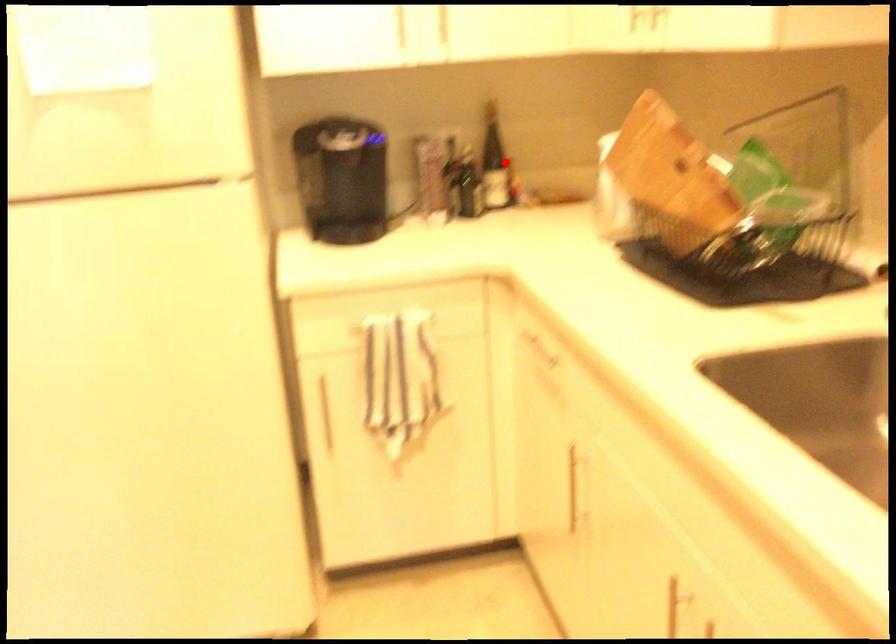
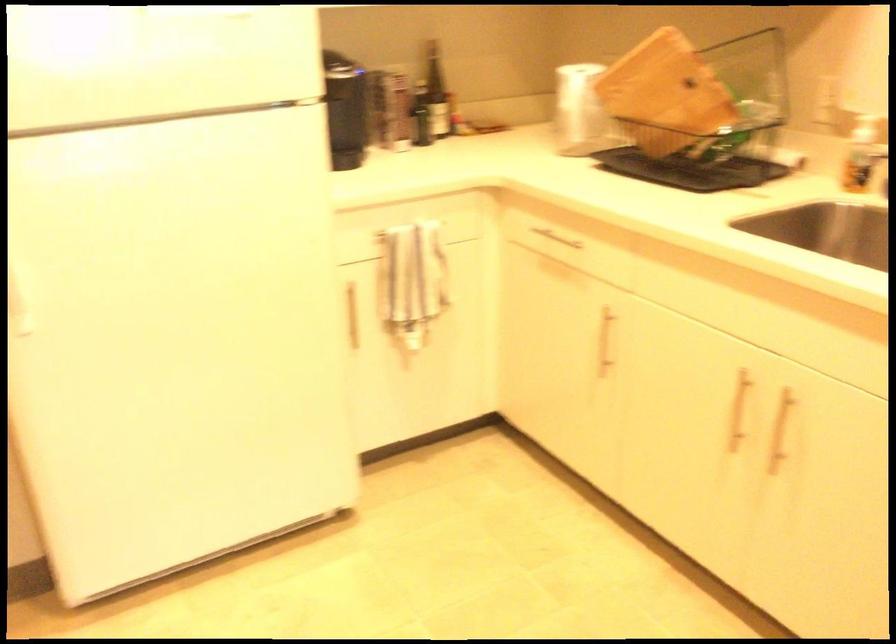
Question: I am providing you with two images of the same scene from different viewpoints. A red point is marked on the first image. At the location where the point appears in image 1, is it still visible in image 2?

Choices:
 (A) Yes
 (B) No

Answer: (A)